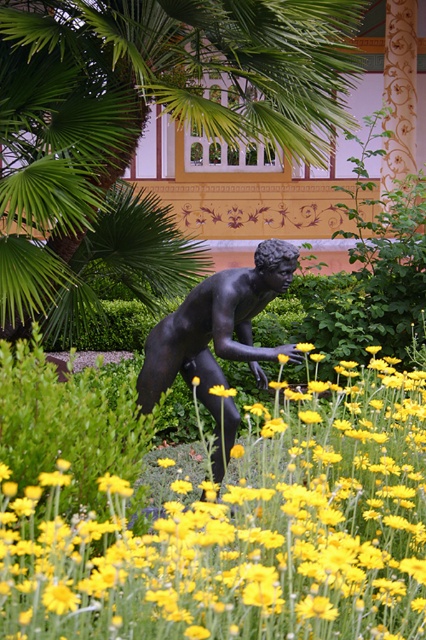
You are a gardener standing at the edge of the garden. You need to locate the yellow matte flower at center. According to the coordinates provided, where should you look relative to the bronze statue of a male figure?

The yellow matte flower at center is located at point 0.834 on the x axis and 0.568 on the y axis, which is to the right and slightly above the bronze statue of a male figure.

You are standing in the garden looking at the bronze statue. There are two points marked in the scene. The first point is at coordinates point (71,604) and the second point is at point (281,273). Which point is closer to you?

Point (71,604) is in front of point (281,273), so the first point is closer to you.

You are standing in the garden and want to place a small decorative stone between the yellow matte flower at center and the bronze statue at center. Based on their positions, which direction should you move from the statue to place the stone between them?

You should move to the right of the bronze statue at center because the yellow matte flower at center is located to the right of it, so placing the stone between them would require positioning it to the right side of the statue.